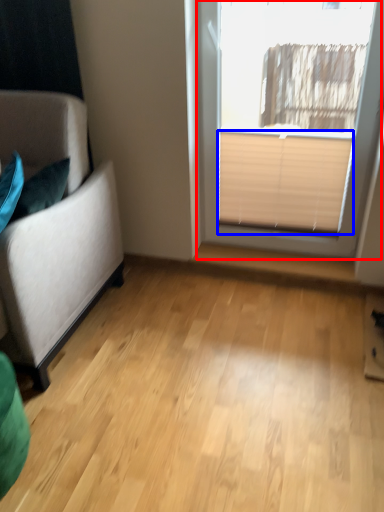
Question: Which of the following is the farthest to the observer, window (highlighted by a red box) or blind (highlighted by a blue box)?

Choices:
 (A) window
 (B) blind

Answer: (B)